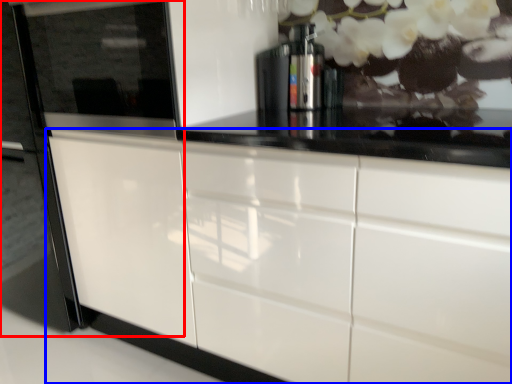
Question: Which object appears closest to the camera in this image, fridge (highlighted by a red box) or cabinetry (highlighted by a blue box)?

Choices:
 (A) fridge
 (B) cabinetry

Answer: (B)